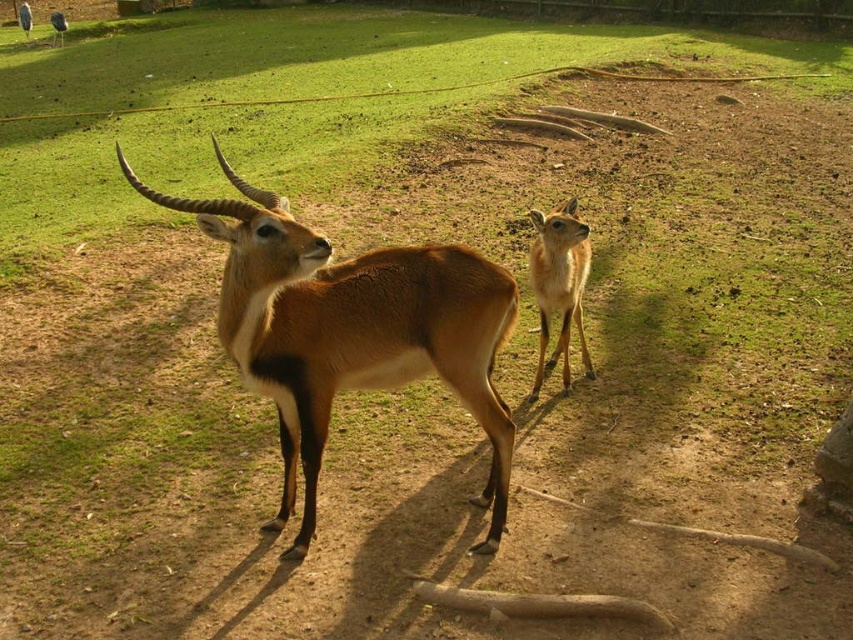
Question: Which of the following is the farthest from the observer?

Choices:
 (A) (450, 284)
 (B) (224, 109)
 (C) (585, 346)

Answer: (B)

Question: Does green grass at center have a lesser width compared to brown glossy antelope at center?

Choices:
 (A) no
 (B) yes

Answer: (A)

Question: Is brown glossy antelope at center wider than light brown fur at center?

Choices:
 (A) yes
 (B) no

Answer: (A)

Question: Which is nearer to the brown glossy antelope at center?

Choices:
 (A) light brown fur at center
 (B) green grass at center

Answer: (A)

Question: From the image, what is the correct spatial relationship of brown glossy antelope at center in relation to light brown fur at center?

Choices:
 (A) above
 (B) below

Answer: (B)

Question: Among these objects, which one is nearest to the camera?

Choices:
 (A) brown glossy antelope at center
 (B) green grass at center

Answer: (A)